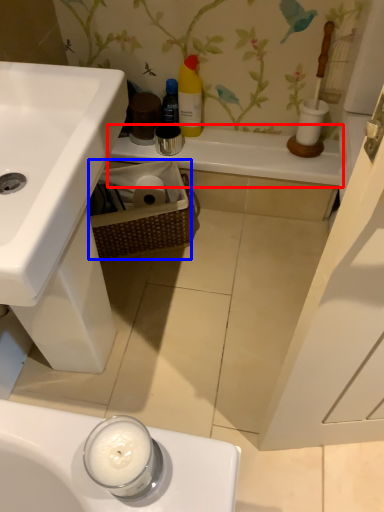
Question: Among these objects, which one is nearest to the camera, counter top (highlighted by a red box) or basket (highlighted by a blue box)?

Choices:
 (A) counter top
 (B) basket

Answer: (B)